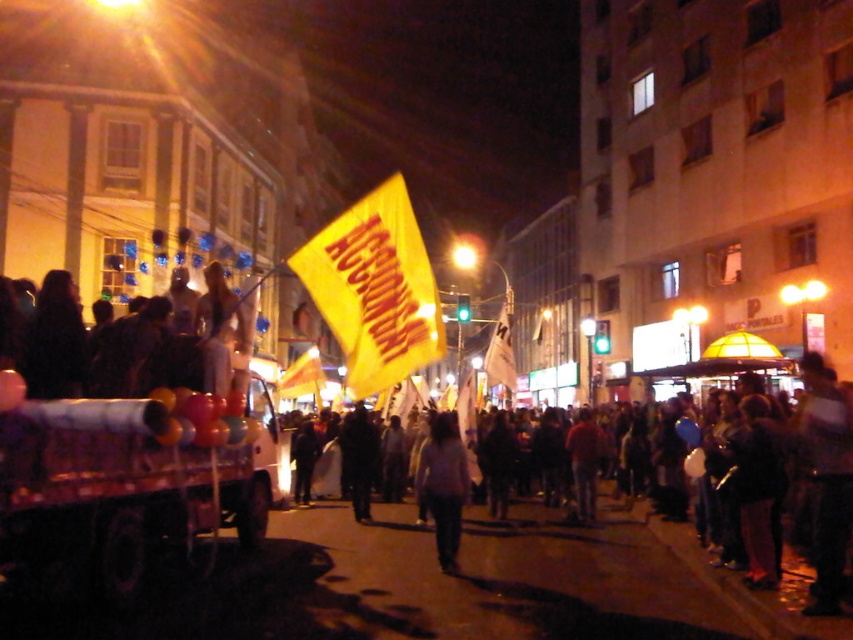
You are a photographer at the event and want to capture a clear shot of the light gray sweater at center without the dark fabric jacket at center blocking it. What should you do?

Move the camera forward so the light gray sweater at center is no longer behind the dark fabric jacket at center.

What are the coordinates of the yellow paper flag at center?

The yellow paper flag at center is located at coordinates point (521, 577).

You are a photographer standing at the edge of the crowd. You want to take a photo of the yellow paper flag at center and the dark fabric jacket at center. Which object will appear larger in your photo?

The yellow paper flag at center will appear larger in the photo because it is closer to the viewer than the dark fabric jacket at center.